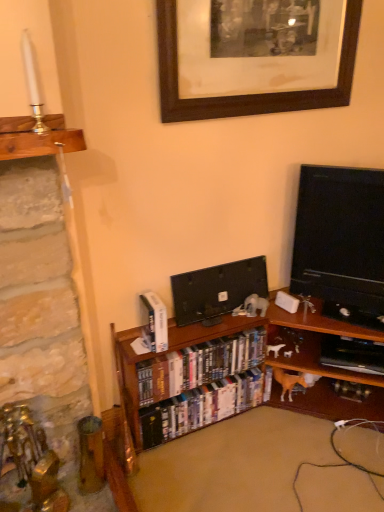
Question: Does shiny plastic dvds at center, positioned as the 2th book in top-to-bottom order, touch wooden bookcase at center?

Choices:
 (A) no
 (B) yes

Answer: (A)

Question: Is shiny plastic dvds at center, the second book ordered from the bottom, taller than wooden bookcase at center?

Choices:
 (A) no
 (B) yes

Answer: (A)

Question: Considering the relative sizes of shiny plastic dvds at center, positioned as the 2th book in top-to-bottom order, and wooden bookcase at center in the image provided, is shiny plastic dvds at center, positioned as the 2th book in top-to-bottom order, shorter than wooden bookcase at center?

Choices:
 (A) no
 (B) yes

Answer: (B)

Question: Does shiny plastic dvds at center, positioned as the 2th book in top-to-bottom order, turn towards wooden bookcase at center?

Choices:
 (A) no
 (B) yes

Answer: (B)

Question: From a real-world perspective, does shiny plastic dvds at center, the second book ordered from the bottom, sit lower than wooden bookcase at center?

Choices:
 (A) yes
 (B) no

Answer: (B)

Question: Is wooden bookcase at center inside shiny plastic dvds at center, the second book ordered from the bottom?

Choices:
 (A) yes
 (B) no

Answer: (B)

Question: From the image's perspective, is white glossy book at center, placed as the first book when sorted from top to bottom, under black glossy tv at right, the 1th television when ordered from right to left?

Choices:
 (A) no
 (B) yes

Answer: (B)

Question: Is white glossy book at center, placed as the 3th book when sorted from bottom to top, positioned far away from black glossy tv at right, which ranks as the 2th television in left-to-right order?

Choices:
 (A) no
 (B) yes

Answer: (A)

Question: Is the position of white glossy book at center, placed as the first book when sorted from top to bottom, less distant than that of black glossy tv at right, the 1th television when ordered from right to left?

Choices:
 (A) no
 (B) yes

Answer: (A)

Question: From the image's perspective, is white glossy book at center, placed as the first book when sorted from top to bottom, located above black glossy tv at right, the 1th television when ordered from right to left?

Choices:
 (A) yes
 (B) no

Answer: (B)

Question: Is white glossy book at center, placed as the 3th book when sorted from bottom to top, facing away from black glossy tv at right, the 1th television when ordered from right to left?

Choices:
 (A) yes
 (B) no

Answer: (B)

Question: Is white glossy book at center, placed as the first book when sorted from top to bottom, behind black glossy tv at right, the 1th television when ordered from right to left?

Choices:
 (A) no
 (B) yes

Answer: (B)

Question: Can you confirm if hardcover books at center, acting as the 1th book starting from the bottom, is wider than black glossy flat-screen tv at center, placed as the second television when sorted from right to left?

Choices:
 (A) yes
 (B) no

Answer: (A)